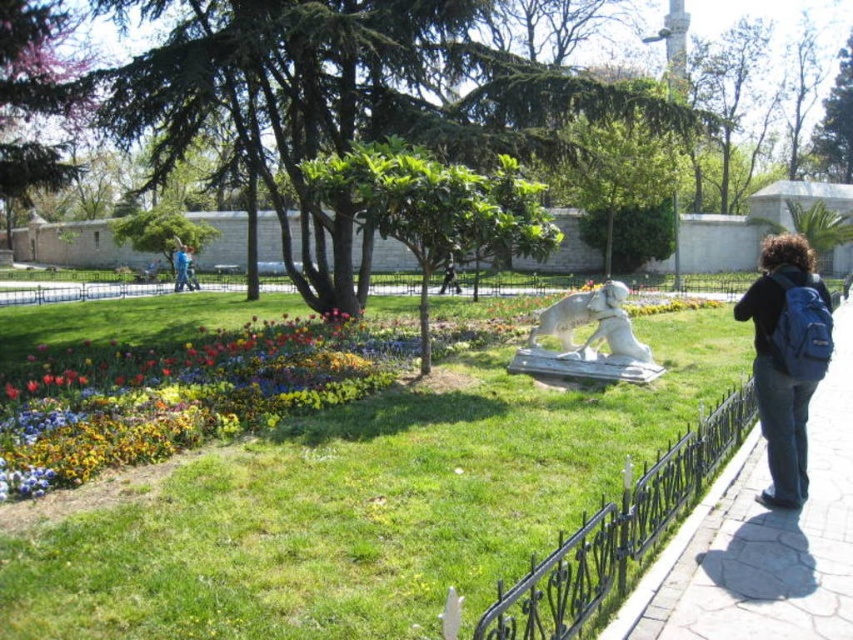
You are standing at the camera position and want to walk to the green grass at center. What are the coordinates of the point you need to walk to?

The coordinates of the green grass at center are at point (367, 506).

You are a photographer trying to capture both the white marble statue at center and the dark blue backpack at center in a single frame. Based on their positions, which object should you adjust your camera angle to focus on first if you want to include both without moving either object?

You should focus on the dark blue backpack at center first since the white marble statue at center is to the right of it, allowing you to frame both by adjusting your angle to the left.

You are standing in the park and want to walk towards the green grass at center. Which direction should you move relative to the blue backpack at right?

You should move towards the green grass at center, which is closer to you than the blue backpack at right. Since the blue backpack at right is farther away, moving toward the grass would mean moving away from the backpack.